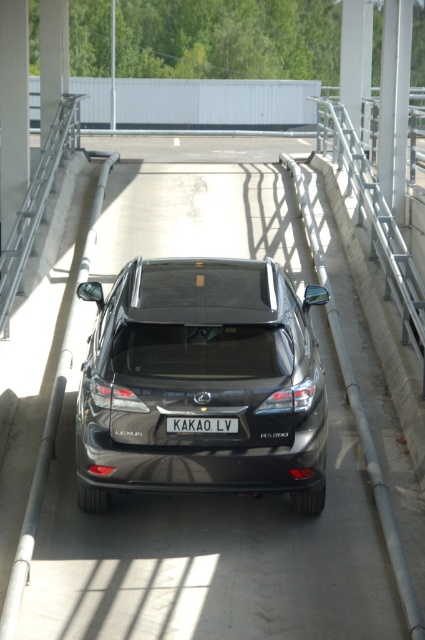
You are standing at the entrance of the parking structure and see the black Lexus RX 450h SUV parked centrally. There are two points marked on the floor. If you walk towards the SUV, which point will you step on first, point (297, 397) or point (204, 420)?

Point (204, 420) will be stepped on first because it is in front of point (297, 397) when approaching the SUV from the entrance.

You are a parking assistant in a covered parking structure. You need to guide a driver to park their car in the spot where the point is located. The point is marked at coordinates (201, 381). Based on the scene description, what should the driver do to park their car correctly?

The point at coordinates (201, 381) marks the satin black SUV at center. The driver should position their car centrally in the parking spot, ensuring it faces away from the camera, similar to the existing SUV. Align the vehicle with the concrete floor markings and ensure there is enough space between the metallic railings on both sides for safe entry and exit.

You are standing at the entrance of the parking structure and want to locate the satin black suv at center. According to the coordinates provided, where should you look to find it?

The satin black suv at center is located at coordinates point (201,381). Since the entrance is at the bottom left corner, you should look towards the upper right direction from your position to find it.